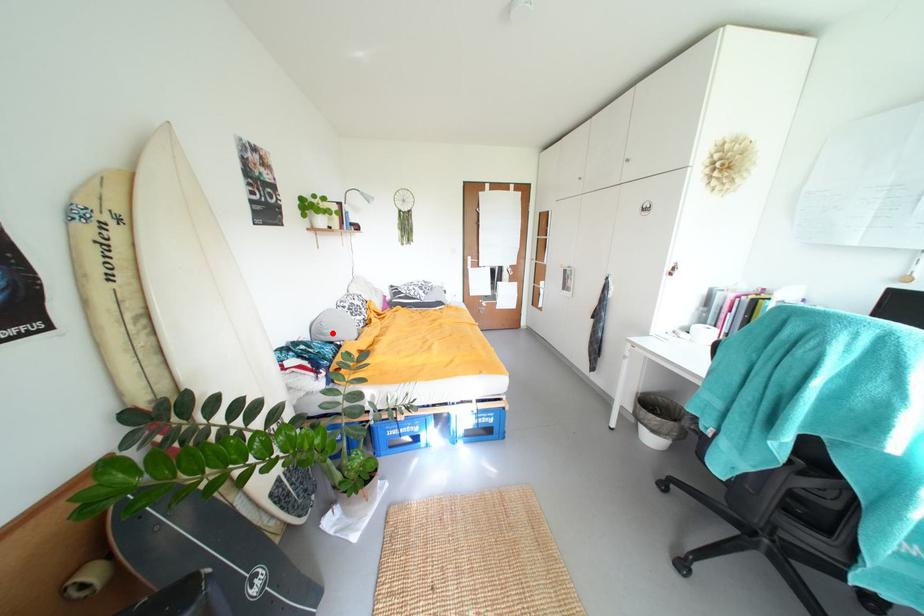
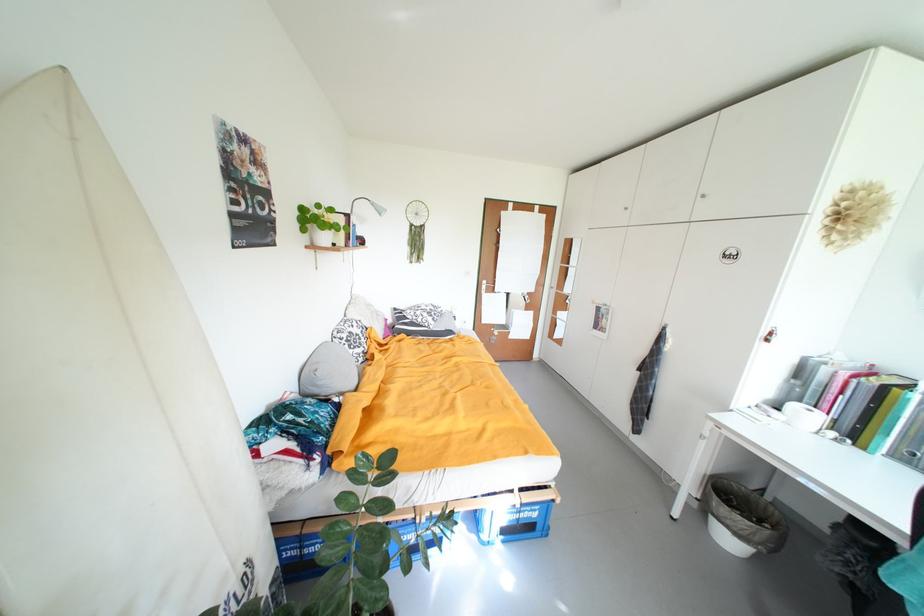
The point at the highlighted location is marked in the first image. Where is the corresponding point in the second image?

(326, 385)